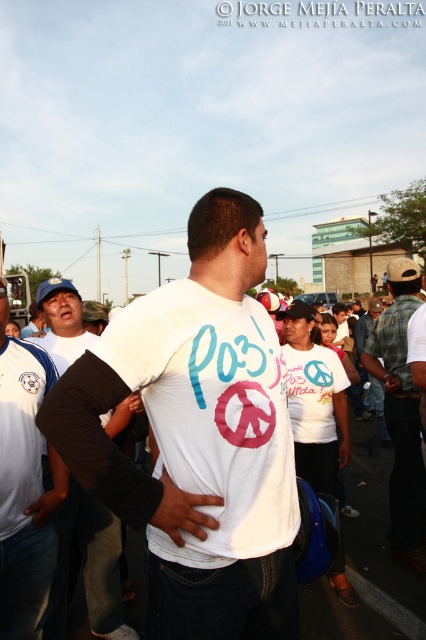
Question: Which point appears closest to the camera in this image?

Choices:
 (A) (416, 460)
 (B) (238, 504)
 (C) (86, 493)

Answer: (B)

Question: Is white matte t-shirt at center positioned at the back of plaid flannel shirt at center?

Choices:
 (A) yes
 (B) no

Answer: (B)

Question: Is white matte t-shirt at center positioned at the back of white jersey at center?

Choices:
 (A) no
 (B) yes

Answer: (A)

Question: Which object is positioned closest to the denim jacket at center?

Choices:
 (A) plaid flannel shirt at center
 (B) white jersey at center
 (C) white matte t-shirt at center
 (D) black cotton shirt at left

Answer: (A)

Question: Is white matte t-shirt at center to the right of white jersey at center from the viewer's perspective?

Choices:
 (A) no
 (B) yes

Answer: (B)

Question: Estimate the real-world distances between objects in this image. Which object is farther from the white matte t-shirt at center?

Choices:
 (A) plaid flannel shirt at center
 (B) black cotton shirt at left
 (C) white jersey at center

Answer: (A)